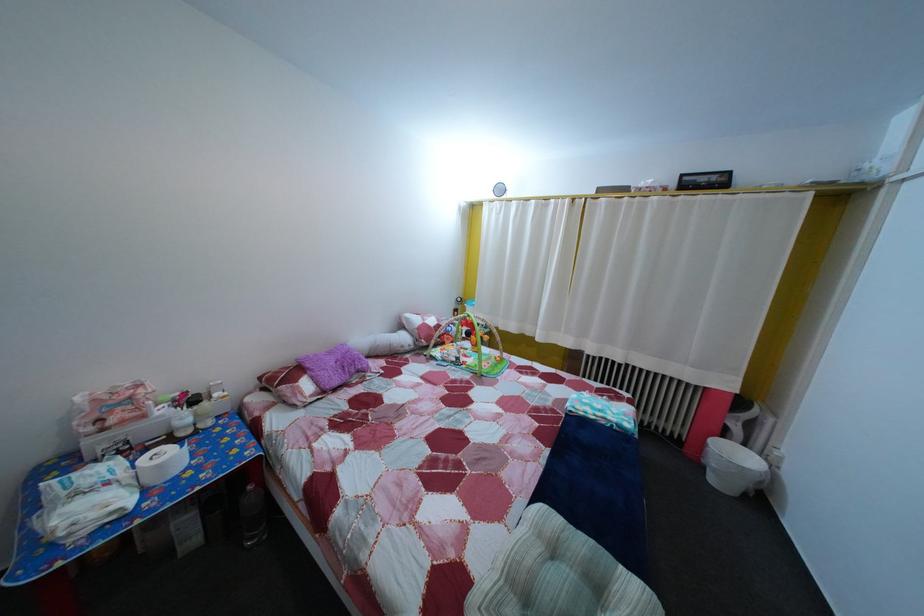
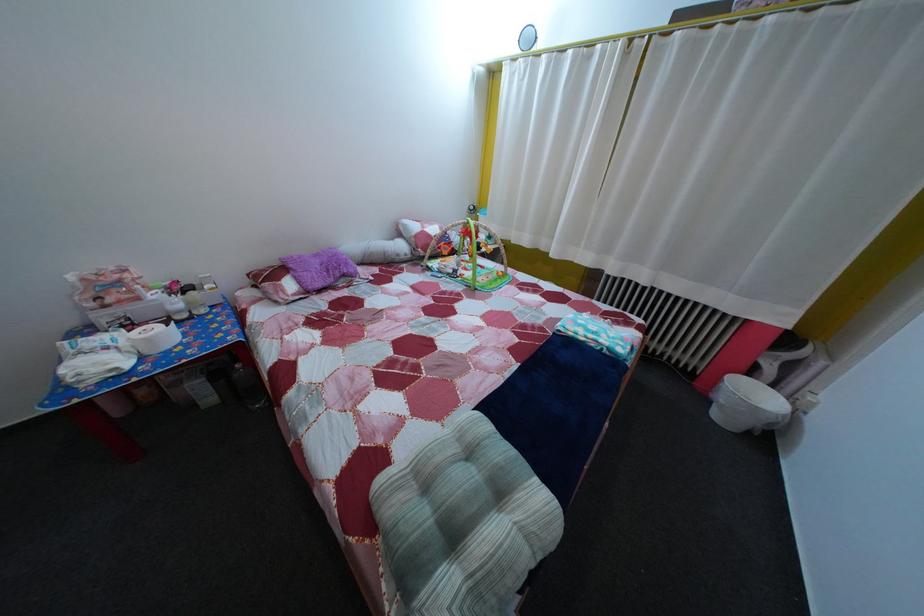
Locate, in the second image, the point that corresponds to point (226, 402) in the first image.

(216, 294)